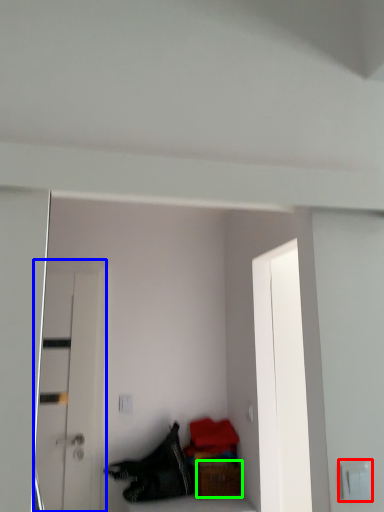
Question: Considering the real-world distances, which object is farthest from electric outlet (highlighted by a red box)? door (highlighted by a blue box) or furniture (highlighted by a green box)?

Choices:
 (A) door
 (B) furniture

Answer: (A)